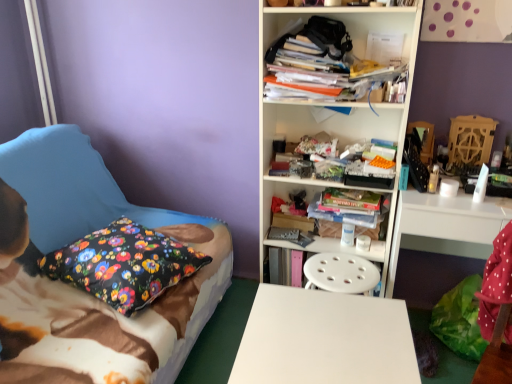
Question: Choose the correct answer: Is floral fabric pillow at left inside white glossy computer desk at right or outside it?

Choices:
 (A) inside
 (B) outside

Answer: (B)

Question: From a real-world perspective, is floral fabric pillow at left physically located above or below white glossy computer desk at right?

Choices:
 (A) above
 (B) below

Answer: (A)

Question: Considering the real-world distances, which object is closest to the floral fabric pillow at left?

Choices:
 (A) white glossy computer desk at right
 (B) white plastic bookcase at center
 (C) stacked books at center
 (D) floral fabric pillow at left
 (E) white smooth desk at center

Answer: (D)

Question: Based on their relative distances, which object is nearer to the white glossy computer desk at right?

Choices:
 (A) white plastic bookcase at center
 (B) floral fabric pillow at left
 (C) white smooth desk at center
 (D) stacked books at center
 (E) floral fabric pillow at left

Answer: (D)